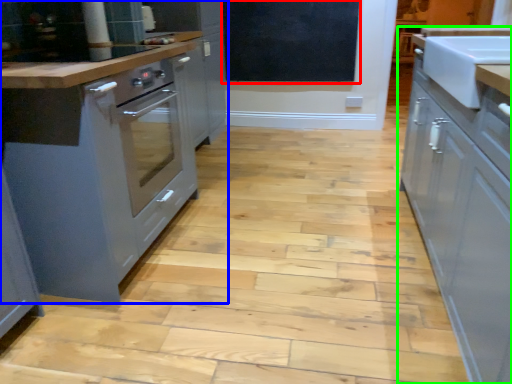
Question: Estimate the real-world distances between objects in this image. Which object is closer to bulletin board (highlighted by a red box), cabinetry (highlighted by a blue box) or cabinetry (highlighted by a green box)?

Choices:
 (A) cabinetry
 (B) cabinetry

Answer: (A)